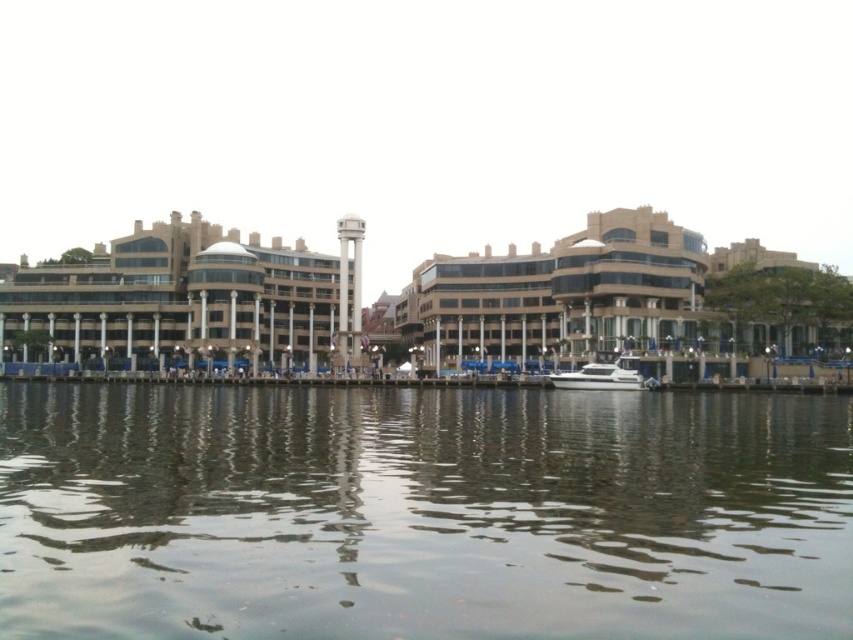
Is greenish reflective water at center to the left of white glossy boat at center from the viewer's perspective?

Yes, greenish reflective water at center is to the left of white glossy boat at center.

Does greenish reflective water at center have a lesser height compared to white glossy boat at center?

Incorrect, greenish reflective water at center's height does not fall short of white glossy boat at center's.

Is point (432, 576) less distant than point (639, 387)?

Yes, it is in front of point (639, 387).

You are a GUI agent. You are given a task and a screenshot of the screen. Output one action in this format:
    pyautogui.click(x=<x>, y=<y>)
    Task: Click on the greenish reflective water at center
    This screenshot has height=640, width=853.
    Given the screenshot: What is the action you would take?
    pyautogui.click(x=421, y=513)